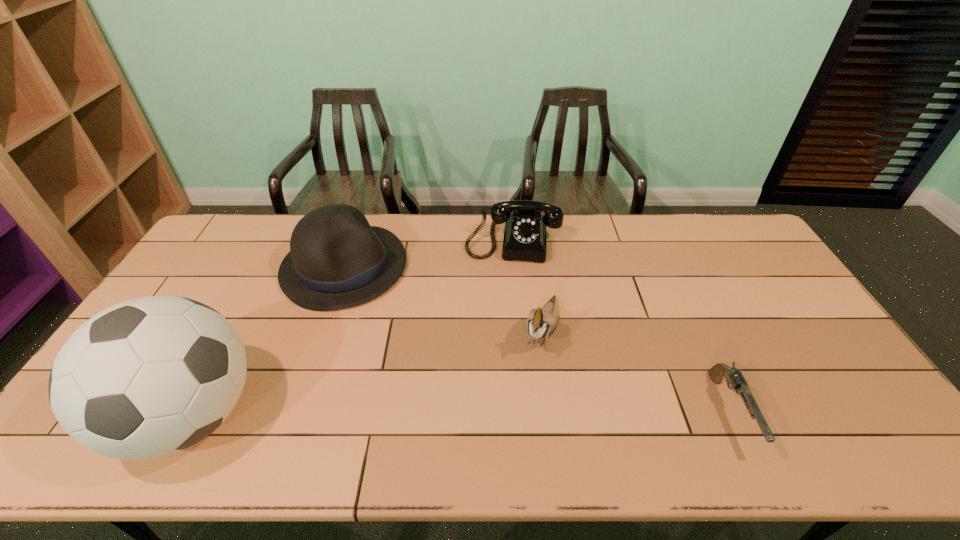
Image resolution: width=960 pixels, height=540 pixels. In order to click on free spot on the desktop that is between the soccer ball and the rightmost object and is positioned at the face of the bird in this screenshot , I will do `click(511, 414)`.

The height and width of the screenshot is (540, 960). I want to click on free space on the desktop that is between the soccer ball and the rightmost object and is positioned on the front-facing side of the bowler hat, so click(529, 414).

Identify the location of vacant space on the desktop that is between the soccer ball and the shortest object and is positioned on the dial of the telephone. The width and height of the screenshot is (960, 540). (496, 414).